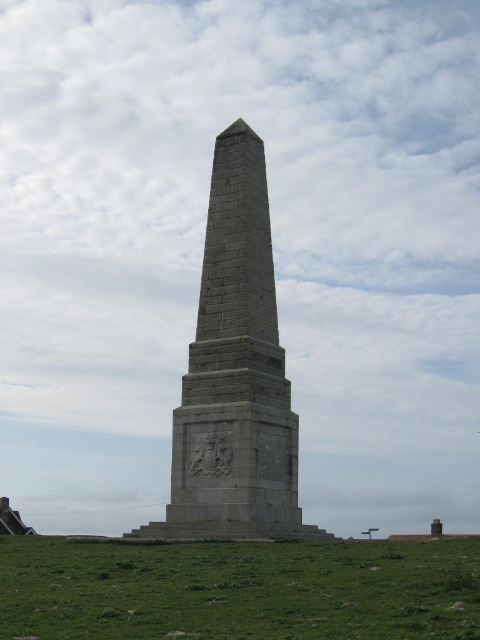
Question: Is green grassy field at lower center to the right of gray stone obelisk at center from the viewer's perspective?

Choices:
 (A) no
 (B) yes

Answer: (A)

Question: Is green grassy field at lower center in front of gray stone obelisk at center?

Choices:
 (A) yes
 (B) no

Answer: (A)

Question: Which point is farther from the camera taking this photo?

Choices:
 (A) (132, 600)
 (B) (229, 294)

Answer: (B)

Question: Can you confirm if green grassy field at lower center is wider than gray stone obelisk at center?

Choices:
 (A) no
 (B) yes

Answer: (B)